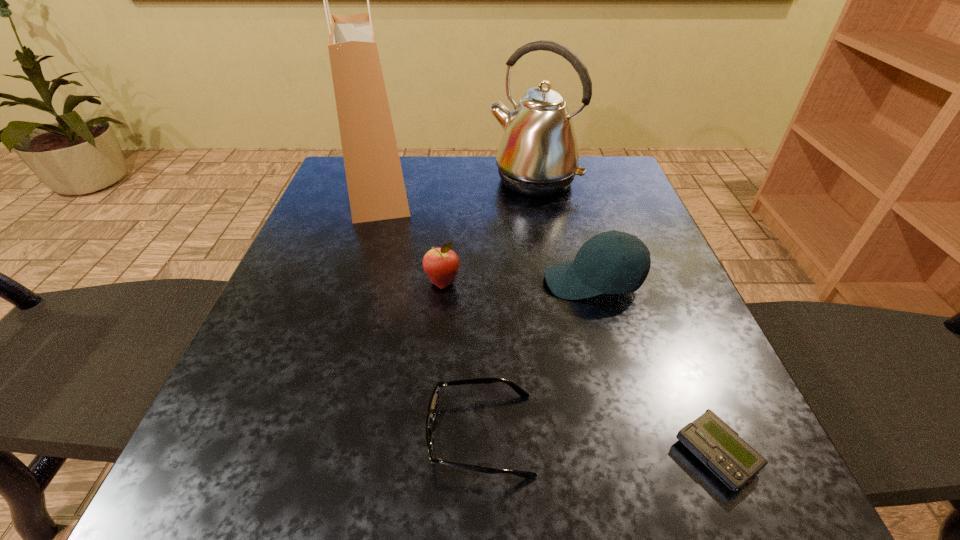
The image size is (960, 540). What are the coordinates of `beeper that is at the near edge` in the screenshot? It's located at (710, 439).

This screenshot has height=540, width=960. Find the location of `object that is at the left edge`. object that is at the left edge is located at coordinates (376, 188).

The width and height of the screenshot is (960, 540). I want to click on kettle located in the right edge section of the desktop, so click(538, 156).

Locate an element on the screen. baseball cap that is positioned at the right edge is located at coordinates (612, 262).

Where is `beeper that is at the right edge`? Image resolution: width=960 pixels, height=540 pixels. beeper that is at the right edge is located at coordinates (710, 439).

Where is `object that is at the far left corner`? This screenshot has height=540, width=960. object that is at the far left corner is located at coordinates (376, 188).

Identify the location of object present at the far right corner. The width and height of the screenshot is (960, 540). (538, 156).

Identify the location of object present at the near right corner. Image resolution: width=960 pixels, height=540 pixels. (710, 439).

In the image, there is a desktop. Where is `vacant space at the far edge`? This screenshot has height=540, width=960. vacant space at the far edge is located at coordinates (438, 178).

Where is `vacant space at the near edge of the desktop`? This screenshot has width=960, height=540. vacant space at the near edge of the desktop is located at coordinates (433, 485).